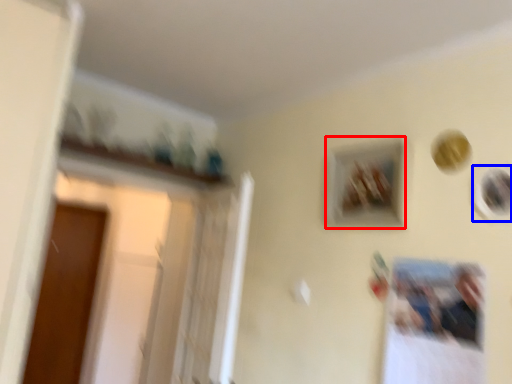
Question: Which object appears farthest to the camera in this image, picture frame (highlighted by a red box) or picture frame (highlighted by a blue box)?

Choices:
 (A) picture frame
 (B) picture frame

Answer: (A)